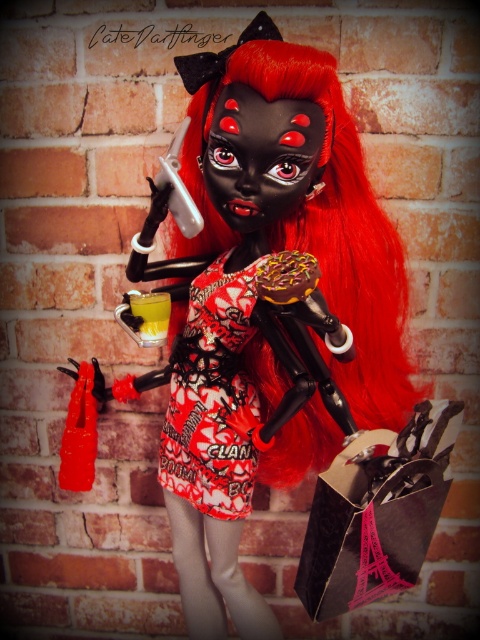
You are a delivery person who needs to place the yellow translucent liquid at center into the black paper shopping bag at lower right. Can you fit the liquid container into the bag?

The black paper shopping bag at lower right might be wider than yellow translucent liquid at center, so there is a possibility that the liquid container will fit inside the bag.

You are an artist observing the doll and its surroundings. You notice the printed fabric dress at center and the yellow translucent liquid at center. Which object is located to the left of the other?

The printed fabric dress at center is positioned on the right side of yellow translucent liquid at center, so the yellow translucent liquid at center is to the left of the printed fabric dress at center.

You are standing in front of the doll and want to touch the two points on its dress. The first point is at coordinate point (445,436) and the second point is at coordinate point (240,465). Which point should you reach for first if you want to touch the one closer to you?

Point (445,436) is in front of point (240,465), so you should reach for point (445,436) first as it is closer to you.